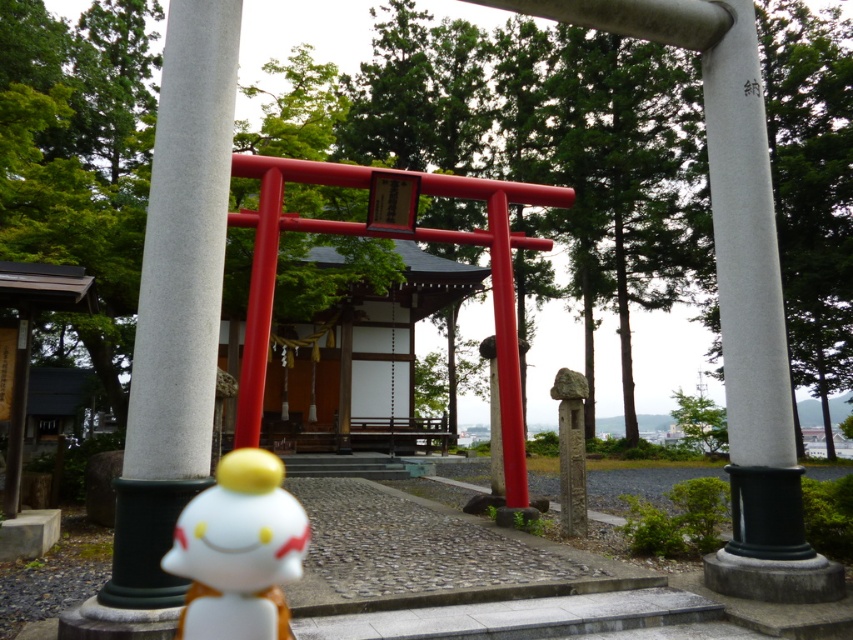
You are visiting a Japanese shrine and see the smooth gray stone pillar at center and the white glossy figurine at lower center. Which object is taller?

The smooth gray stone pillar at center is much taller than the white glossy figurine at lower center.

You are a visitor standing at the entrance of the shrine and want to place a small offering at the base of the smooth gray stone pillar at center. You have a 4 feet long stick. Can you reach the pillar from where the white glossy figurine at lower center is placed using the stick?

The smooth gray stone pillar at center is 3.90 feet away from the white glossy figurine at lower center. Since the stick is 4 feet long, you can extend it to reach the pillar from the figurine.